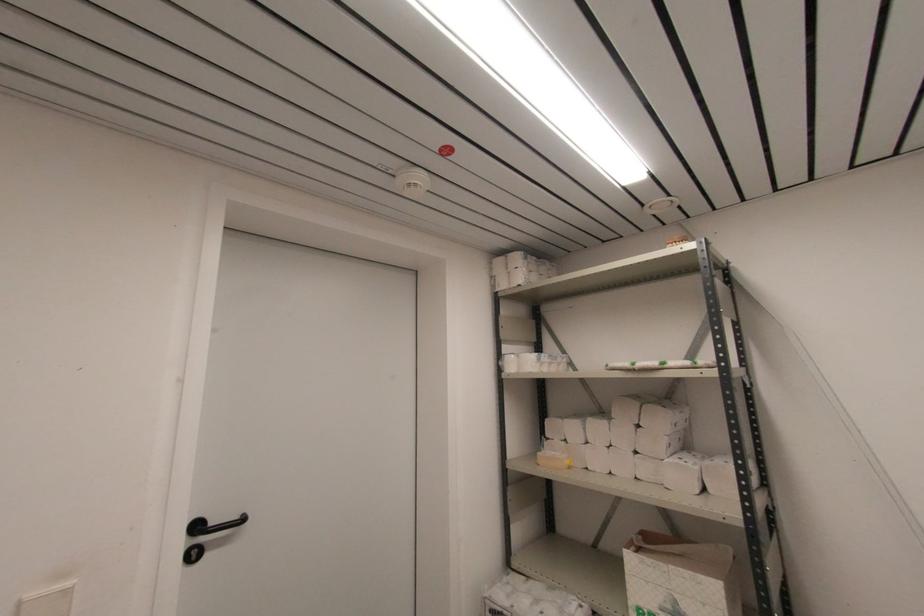
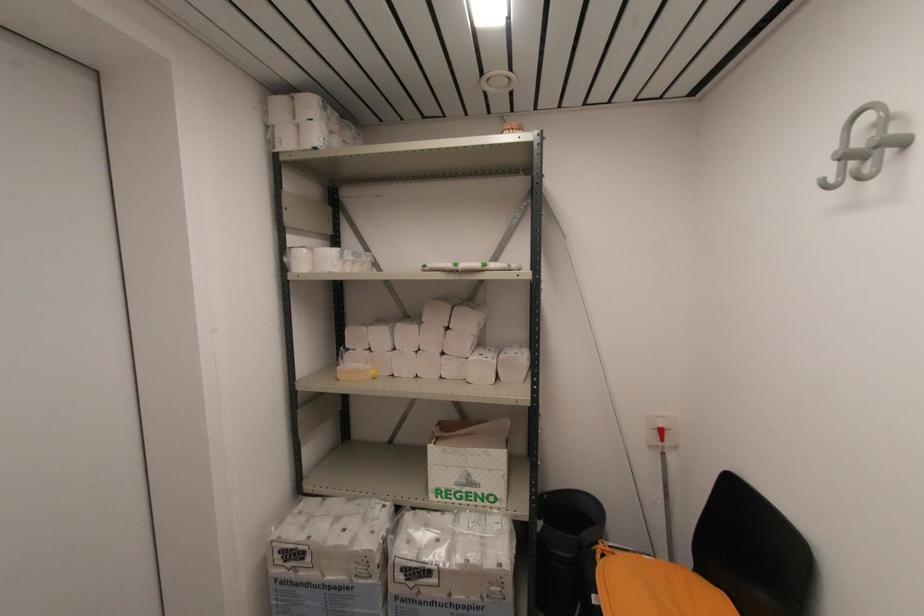
Locate, in the second image, the point that corresponds to point 540,464 in the first image.

(339, 381)